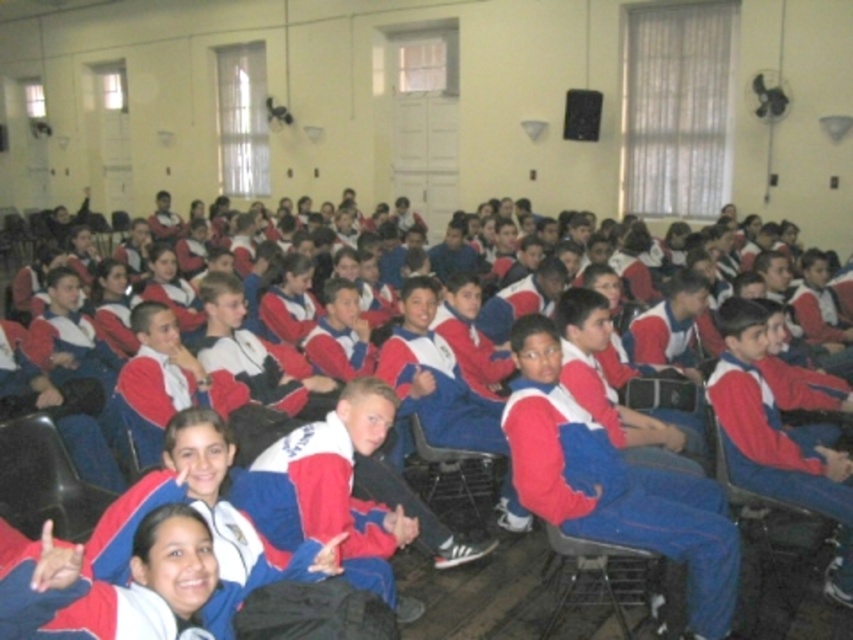
Question: Considering the real-world distances, which object is closest to the metallic gray chair at center?

Choices:
 (A) metallic gray chair at lower center
 (B) matte blue jumpsuit at center

Answer: (A)

Question: Does matte blue jumpsuit at center appear on the left side of metallic gray chair at lower center?

Choices:
 (A) no
 (B) yes

Answer: (A)

Question: Is metallic gray chair at lower center positioned before metallic gray chair at center?

Choices:
 (A) yes
 (B) no

Answer: (A)

Question: Is matte blue jumpsuit at center smaller than metallic gray chair at center?

Choices:
 (A) no
 (B) yes

Answer: (A)

Question: Which point is closer to the camera?

Choices:
 (A) metallic gray chair at lower center
 (B) matte blue jumpsuit at center

Answer: (B)

Question: Which object is farther from the camera taking this photo?

Choices:
 (A) metallic gray chair at center
 (B) matte blue jumpsuit at center
 (C) metallic gray chair at lower center

Answer: (A)